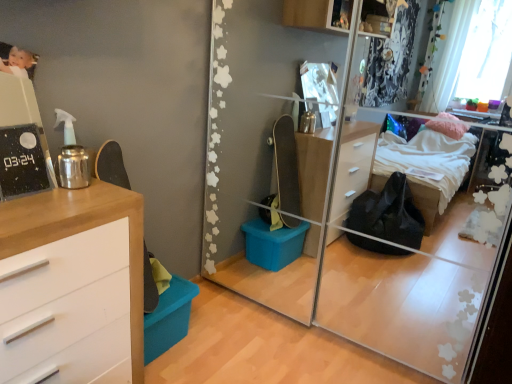
You are a GUI agent. You are given a task and a screenshot of the screen. Output one action in this format:
    pyautogui.click(x=<x>, y=<y>)
    Task: Click on the wooden chest of drawers at left
    
    Given the screenshot: What is the action you would take?
    73,286

The height and width of the screenshot is (384, 512). What do you see at coordinates (73, 286) in the screenshot?
I see `wooden chest of drawers at left` at bounding box center [73, 286].

You are a GUI agent. You are given a task and a screenshot of the screen. Output one action in this format:
    pyautogui.click(x=<x>, y=<y>)
    Task: Click on the transparent glass mirror at center
    
    Given the screenshot: What is the action you would take?
    pyautogui.click(x=313, y=224)

The width and height of the screenshot is (512, 384). Describe the element at coordinates (313, 224) in the screenshot. I see `transparent glass mirror at center` at that location.

At what (x,y) coordinates should I click in order to perform the action: click on wooden chest of drawers at left. Please return your answer as a coordinate pair (x, y). Image resolution: width=512 pixels, height=384 pixels. Looking at the image, I should click on click(73, 286).

Visually, is wooden chest of drawers at left positioned to the left or to the right of transparent glass mirror at center?

Based on their positions, wooden chest of drawers at left is located to the left of transparent glass mirror at center.

Which object is more forward, wooden chest of drawers at left or transparent glass mirror at center?

wooden chest of drawers at left is closer to the camera.

Which is less distant, (49, 213) or (391, 353)?

Clearly, point (49, 213) is closer to the camera than point (391, 353).

From the image's perspective, is wooden chest of drawers at left positioned above or below transparent glass mirror at center?

wooden chest of drawers at left is below transparent glass mirror at center.

From a real-world perspective, which is physically above, wooden chest of drawers at left or transparent glass mirror at center?

From a 3D spatial view, transparent glass mirror at center is above.

Between wooden chest of drawers at left and transparent glass mirror at center, which one has smaller width?

Thinner between the two is wooden chest of drawers at left.

Which of these two, wooden chest of drawers at left or transparent glass mirror at center, stands shorter?

wooden chest of drawers at left is shorter.

Is wooden chest of drawers at left bigger than transparent glass mirror at center?

No.

Is wooden chest of drawers at left spatially inside transparent glass mirror at center, or outside of it?

wooden chest of drawers at left cannot be found inside transparent glass mirror at center.

Is there a large distance between wooden chest of drawers at left and transparent glass mirror at center?

wooden chest of drawers at left is far away from transparent glass mirror at center.

Is wooden chest of drawers at left aimed at transparent glass mirror at center?

No, wooden chest of drawers at left does not turn towards transparent glass mirror at center.

How far apart are wooden chest of drawers at left and transparent glass mirror at center?

They are 1.31 meters apart.

I want to click on mirror on the right side of wooden chest of drawers at left, so (x=313, y=224).

Visually, is transparent glass mirror at center positioned to the left or to the right of wooden chest of drawers at left?

Based on their positions, transparent glass mirror at center is located to the right of wooden chest of drawers at left.

Which is in front, transparent glass mirror at center or wooden chest of drawers at left?

Positioned in front is wooden chest of drawers at left.

Considering the points (238, 23) and (136, 314), which point is behind, point (238, 23) or point (136, 314)?

The point (238, 23) is behind.

From the image's perspective, between transparent glass mirror at center and wooden chest of drawers at left, which one is located above?

transparent glass mirror at center appears higher in the image.

In the scene shown: From a real-world perspective, does transparent glass mirror at center sit lower than wooden chest of drawers at left?

No, from a real-world perspective, transparent glass mirror at center is not under wooden chest of drawers at left.

Does transparent glass mirror at center have a greater width compared to wooden chest of drawers at left?

Indeed, transparent glass mirror at center has a greater width compared to wooden chest of drawers at left.

Considering the sizes of transparent glass mirror at center and wooden chest of drawers at left in the image, is transparent glass mirror at center taller or shorter than wooden chest of drawers at left?

Considering their sizes, transparent glass mirror at center has more height than wooden chest of drawers at left.

Which of these two, transparent glass mirror at center or wooden chest of drawers at left, is smaller?

wooden chest of drawers at left.

Is wooden chest of drawers at left a part of transparent glass mirror at center?

Actually, wooden chest of drawers at left is outside transparent glass mirror at center.

Consider the image. Is the surface of transparent glass mirror at center in direct contact with wooden chest of drawers at left?

No, transparent glass mirror at center is not touching wooden chest of drawers at left.

Is transparent glass mirror at center facing away from wooden chest of drawers at left?

No.

Where is `chest of drawers below the transparent glass mirror at center (from the image's perspective)`? chest of drawers below the transparent glass mirror at center (from the image's perspective) is located at coordinates (73, 286).

In order to click on chest of drawers on the left of transparent glass mirror at center in this screenshot , I will do `click(73, 286)`.

Locate an element on the screen. The width and height of the screenshot is (512, 384). the chest of drawers below the transparent glass mirror at center (from the image's perspective) is located at coordinates (73, 286).